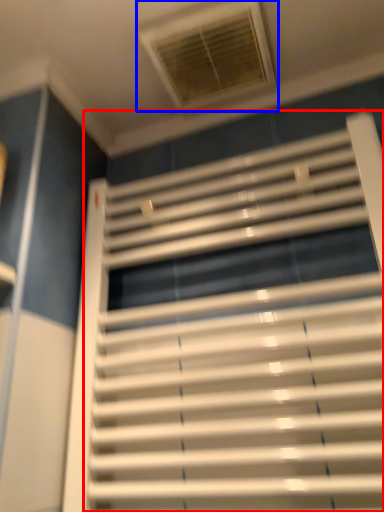
Question: Which object is closer to the camera taking this photo, window blind (highlighted by a red box) or window (highlighted by a blue box)?

Choices:
 (A) window blind
 (B) window

Answer: (A)